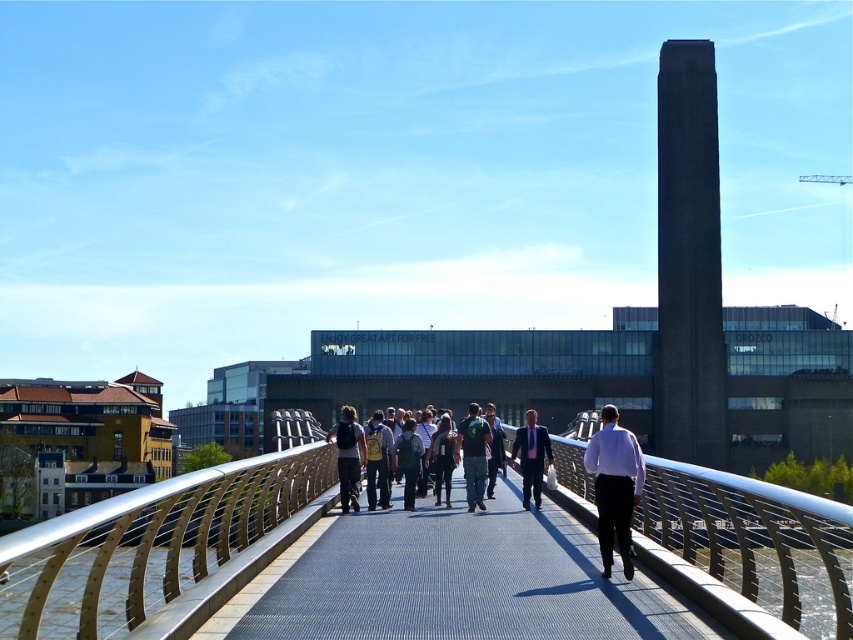
Which is in front, point (424, 625) or point (107, 580)?

Point (107, 580) is in front.

Is blue textured pavement at center above satin silver railing at center?

No.

Identify the location of blue textured pavement at center. This screenshot has height=640, width=853. (453, 582).

Does blue textured pavement at center appear under matte black backpack at center?

Yes.

Does point (218, 624) lie behind point (347, 456)?

No, it is not.

Between point (340, 552) and point (357, 435), which one is positioned behind?

The point (357, 435) is more distant.

What are the coordinates of `blue textured pavement at center` in the screenshot? It's located at (453, 582).

From the picture: Does denim jacket at center have a smaller size compared to dark gray backpack at center?

Incorrect, denim jacket at center is not smaller in size than dark gray backpack at center.

Does point (374, 465) lie behind point (425, 472)?

No, it is in front of (425, 472).

Find the location of `denim jacket at center`. denim jacket at center is located at coordinates (376, 460).

This screenshot has height=640, width=853. I want to click on denim jacket at center, so click(376, 460).